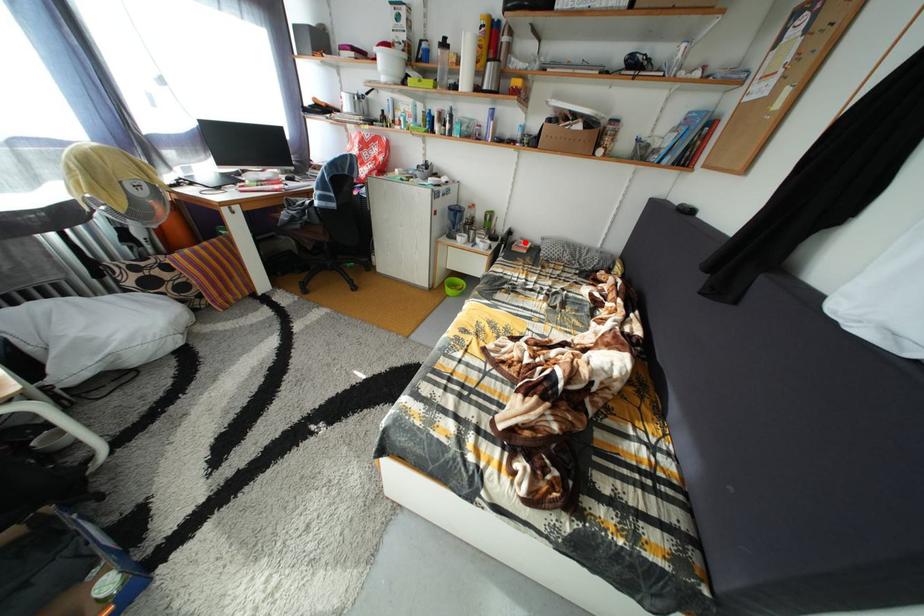
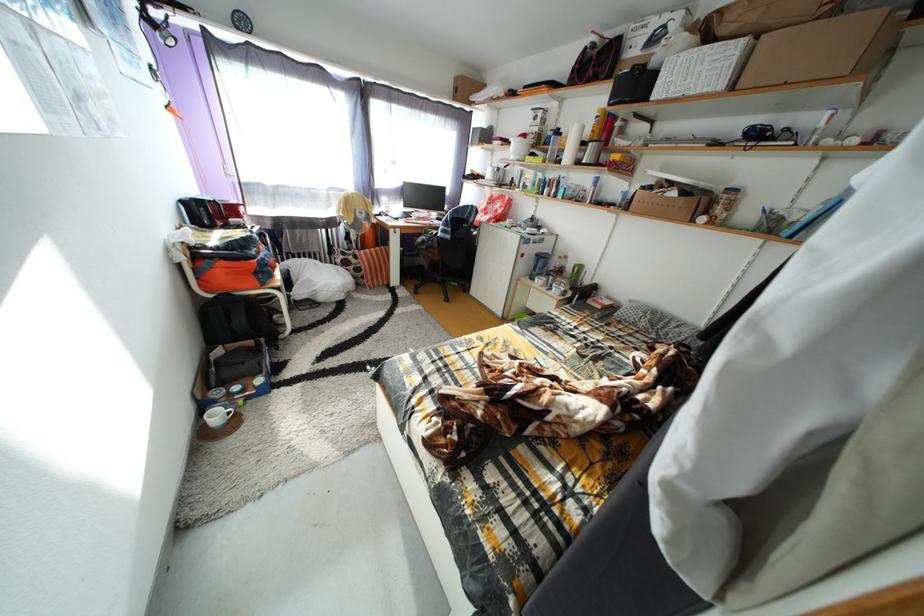
Locate, in the second image, the point that corresponds to the highlighted location in the first image.

(611, 300)